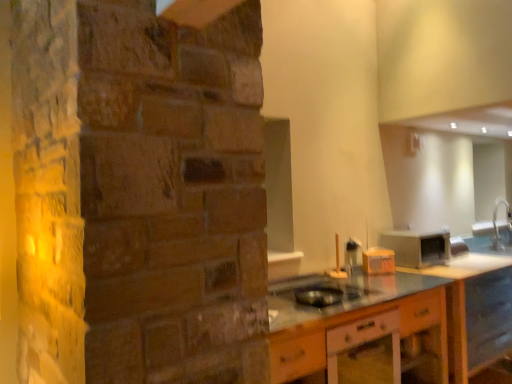
Question: Is metallic silver toaster at right, acting as the first appliance starting from the back, positioned beyond the bounds of wooden cabinet at lower center?

Choices:
 (A) no
 (B) yes

Answer: (B)

Question: From the image's perspective, is metallic silver toaster at right, which is the first appliance in right-to-left order, over wooden cabinet at lower center?

Choices:
 (A) yes
 (B) no

Answer: (A)

Question: From a real-world perspective, is metallic silver toaster at right, positioned as the 3th appliance in front-to-back order, positioned under wooden cabinet at lower center based on gravity?

Choices:
 (A) no
 (B) yes

Answer: (A)

Question: Can you confirm if metallic silver toaster at right, acting as the first appliance starting from the back, is positioned to the right of wooden cabinet at lower center?

Choices:
 (A) no
 (B) yes

Answer: (B)

Question: Can you confirm if metallic silver toaster at right, positioned as the 3th appliance in front-to-back order, is taller than wooden cabinet at lower center?

Choices:
 (A) no
 (B) yes

Answer: (A)

Question: Considering the relative positions of metallic silver toaster at right, acting as the first appliance starting from the back, and wooden cabinet at lower center in the image provided, is metallic silver toaster at right, acting as the first appliance starting from the back, to the left or to the right of wooden cabinet at lower center?

Choices:
 (A) left
 (B) right

Answer: (B)

Question: In terms of height, does metallic silver toaster at right, positioned as the 3th appliance in front-to-back order, look taller or shorter compared to wooden cabinet at lower center?

Choices:
 (A) short
 (B) tall

Answer: (A)

Question: Is point click(x=424, y=251) positioned closer to the camera than point click(x=445, y=362)?

Choices:
 (A) closer
 (B) farther

Answer: (B)

Question: Looking at the image, does metallic silver toaster at right, which is the first appliance in right-to-left order, seem bigger or smaller compared to wooden cabinet at lower center?

Choices:
 (A) big
 (B) small

Answer: (B)

Question: Relative to wooden cabinet at lower center, is orange plastic toaster at center, arranged as the 2th appliance when viewed from the right, in front or behind?

Choices:
 (A) front
 (B) behind

Answer: (B)

Question: From the image's perspective, is orange plastic toaster at center, arranged as the second appliance when viewed from the left, located above or below wooden cabinet at lower center?

Choices:
 (A) below
 (B) above

Answer: (B)

Question: Which is correct: orange plastic toaster at center, placed as the 2th appliance when sorted from front to back, is inside wooden cabinet at lower center, or outside of it?

Choices:
 (A) outside
 (B) inside

Answer: (A)

Question: From a real-world perspective, is orange plastic toaster at center, which ranks as the 2th appliance in back-to-front order, positioned above or below wooden cabinet at lower center?

Choices:
 (A) above
 (B) below

Answer: (A)

Question: Do you think metallic silver toaster at right, which is the first appliance in right-to-left order, is within black plastic bowl at center, arranged as the first appliance when viewed from the front, or outside of it?

Choices:
 (A) inside
 (B) outside

Answer: (B)

Question: Looking at the image, does metallic silver toaster at right, positioned as the 3th appliance in front-to-back order, seem bigger or smaller compared to black plastic bowl at center, which is counted as the third appliance, starting from the right?

Choices:
 (A) small
 (B) big

Answer: (B)